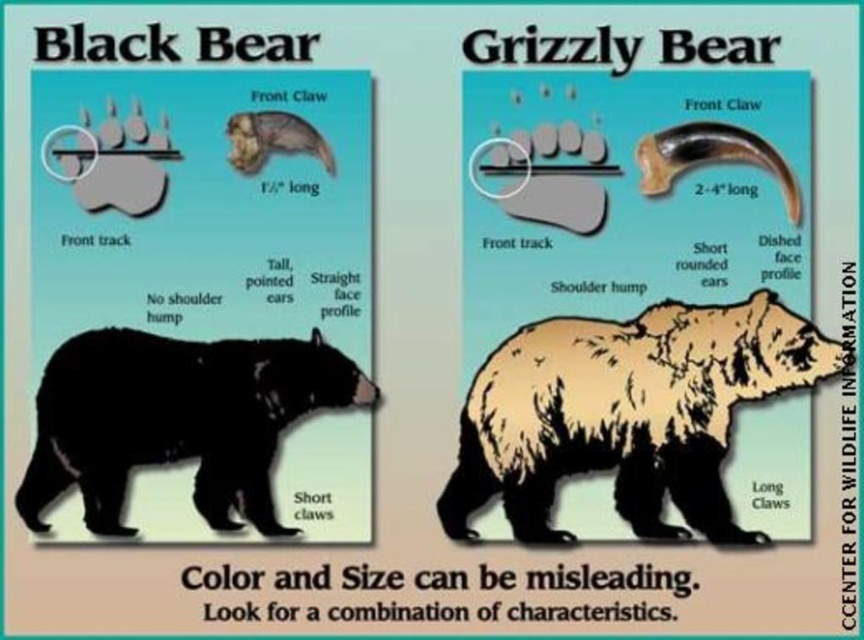
Is brown furry bear at center taller than black matte bear at lower left?

Yes.

Which is behind, point (607, 422) or point (189, 435)?

The point (607, 422) is behind.

The image size is (864, 640). I want to click on brown furry bear at center, so click(627, 413).

Image resolution: width=864 pixels, height=640 pixels. I want to click on brown furry bear at center, so click(x=627, y=413).

Who is taller, brown furry bear at center or smooth brown claw at upper center?

brown furry bear at center

Is point (596, 324) closer to camera compared to point (227, 124)?

No, it is behind (227, 124).

Locate an element on the screen. brown furry bear at center is located at coordinates (627, 413).

Between black matte bear at lower left and smooth brown claw at upper center, which one has less height?

smooth brown claw at upper center is shorter.

Can you confirm if black matte bear at lower left is thinner than smooth brown claw at upper center?

Incorrect, black matte bear at lower left's width is not less than smooth brown claw at upper center's.

Which is in front, point (29, 476) or point (251, 173)?

Point (29, 476) is more forward.

Find the location of a particular element. The image size is (864, 640). black matte bear at lower left is located at coordinates (176, 419).